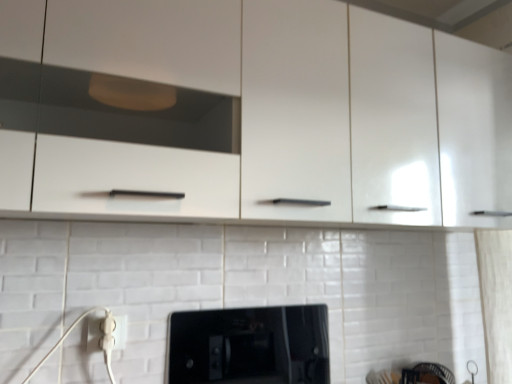
Identify the location of black glossy microwave at center. The image size is (512, 384). (249, 346).

Describe the element at coordinates (249, 346) in the screenshot. Image resolution: width=512 pixels, height=384 pixels. I see `black glossy microwave at center` at that location.

Describe the element at coordinates (94, 334) in the screenshot. This screenshot has height=384, width=512. I see `white plastic electric outlet at lower left` at that location.

The height and width of the screenshot is (384, 512). In order to click on white plastic electric outlet at lower left in this screenshot , I will do `click(94, 334)`.

Locate an element on the screen. This screenshot has width=512, height=384. black glossy microwave at center is located at coordinates (249, 346).

Between black glossy microwave at center and white plastic electric outlet at lower left, which one appears on the right side from the viewer's perspective?

black glossy microwave at center.

Is black glossy microwave at center further to the viewer compared to white plastic electric outlet at lower left?

Yes, it is behind white plastic electric outlet at lower left.

Is point (255, 370) closer or farther from the camera than point (121, 343)?

Clearly, point (255, 370) is more distant from the camera than point (121, 343).

From the image's perspective, is black glossy microwave at center on white plastic electric outlet at lower left?

No, from the image's perspective, black glossy microwave at center is not above white plastic electric outlet at lower left.

From a real-world perspective, between black glossy microwave at center and white plastic electric outlet at lower left, who is vertically higher?

In real-world perspective, white plastic electric outlet at lower left is above.

Considering the relative sizes of black glossy microwave at center and white plastic electric outlet at lower left in the image provided, is black glossy microwave at center thinner than white plastic electric outlet at lower left?

No.

Is black glossy microwave at center taller or shorter than white plastic electric outlet at lower left?

In the image, black glossy microwave at center appears to be taller than white plastic electric outlet at lower left.

Who is smaller, black glossy microwave at center or white plastic electric outlet at lower left?

Smaller between the two is white plastic electric outlet at lower left.

Is black glossy microwave at center outside of white plastic electric outlet at lower left?

Absolutely, black glossy microwave at center is external to white plastic electric outlet at lower left.

Is black glossy microwave at center next to white plastic electric outlet at lower left and touching it?

No, black glossy microwave at center is not next to white plastic electric outlet at lower left.

Is white plastic electric outlet at lower left at the back of black glossy microwave at center?

No, black glossy microwave at center is not facing away from white plastic electric outlet at lower left.

Consider the image. How different are the orientations of black glossy microwave at center and white plastic electric outlet at lower left in degrees?

black glossy microwave at center and white plastic electric outlet at lower left are facing 0.149 degrees away from each other.

How far apart are black glossy microwave at center and white plastic electric outlet at lower left?

A distance of 13.33 inches exists between black glossy microwave at center and white plastic electric outlet at lower left.

This screenshot has height=384, width=512. I want to click on home appliance on the right of the white plastic electric outlet at lower left, so tap(249, 346).

In the scene shown: Between white plastic electric outlet at lower left and black glossy microwave at center, which one appears on the right side from the viewer's perspective?

black glossy microwave at center.

Considering the positions of objects white plastic electric outlet at lower left and black glossy microwave at center in the image provided, who is in front, white plastic electric outlet at lower left or black glossy microwave at center?

white plastic electric outlet at lower left.

Which is closer to the camera, (118, 322) or (203, 341)?

Point (118, 322).

From the image's perspective, who appears lower, white plastic electric outlet at lower left or black glossy microwave at center?

From the image's view, black glossy microwave at center is below.

From a real-world perspective, is white plastic electric outlet at lower left positioned over black glossy microwave at center based on gravity?

Yes, from a real-world perspective, white plastic electric outlet at lower left is over black glossy microwave at center

In terms of width, does white plastic electric outlet at lower left look wider or thinner when compared to black glossy microwave at center?

In the image, white plastic electric outlet at lower left appears to be more narrow than black glossy microwave at center.

Which of these two, white plastic electric outlet at lower left or black glossy microwave at center, stands shorter?

white plastic electric outlet at lower left is shorter.

Considering the sizes of objects white plastic electric outlet at lower left and black glossy microwave at center in the image provided, who is smaller, white plastic electric outlet at lower left or black glossy microwave at center?

Smaller between the two is white plastic electric outlet at lower left.

Does white plastic electric outlet at lower left contain black glossy microwave at center?

No, black glossy microwave at center is not surrounded by white plastic electric outlet at lower left.

Is white plastic electric outlet at lower left directly adjacent to black glossy microwave at center?

white plastic electric outlet at lower left and black glossy microwave at center are clearly separated.

Is white plastic electric outlet at lower left oriented away from black glossy microwave at center?

No, black glossy microwave at center is not at the back of white plastic electric outlet at lower left.

Where is `home appliance behind the white plastic electric outlet at lower left`? home appliance behind the white plastic electric outlet at lower left is located at coordinates (249, 346).

At what (x,y) coordinates should I click in order to perform the action: click on electric outlet above the black glossy microwave at center (from the image's perspective). Please return your answer as a coordinate pair (x, y). Looking at the image, I should click on (94, 334).

Locate an element on the screen. electric outlet above the black glossy microwave at center (from a real-world perspective) is located at coordinates (94, 334).